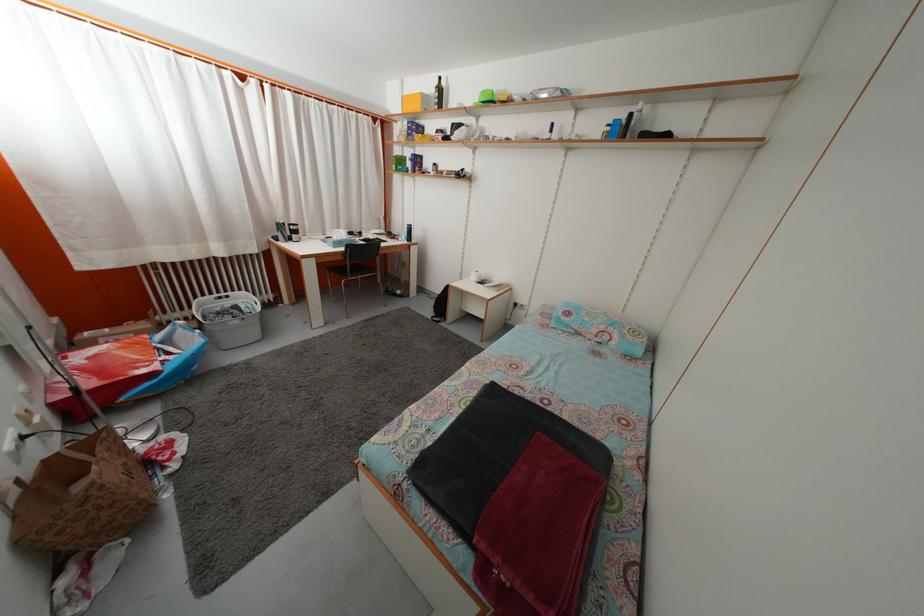
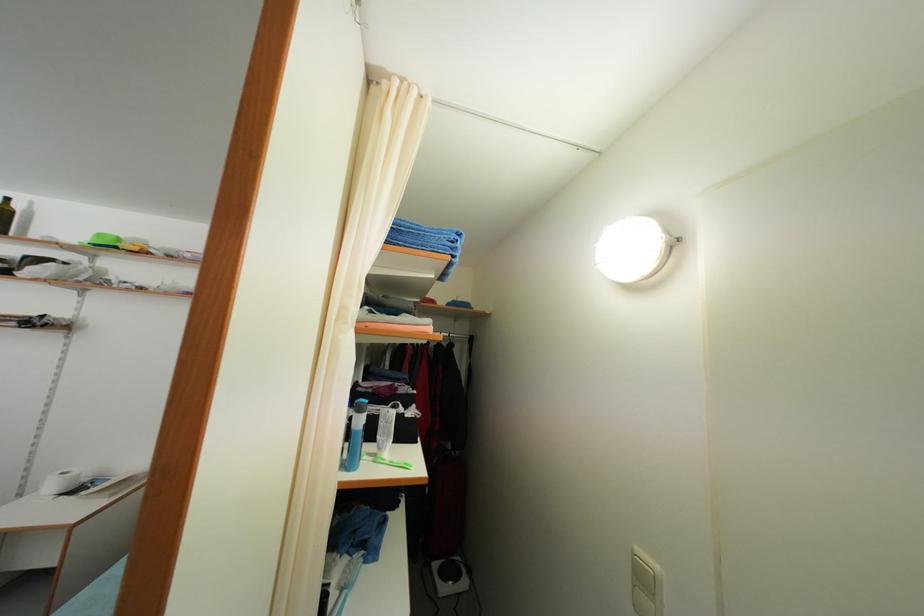
Looking at this image, the images are taken continuously from a first-person perspective. In which direction is your viewpoint rotating?

The rotation direction of the camera is right-up.